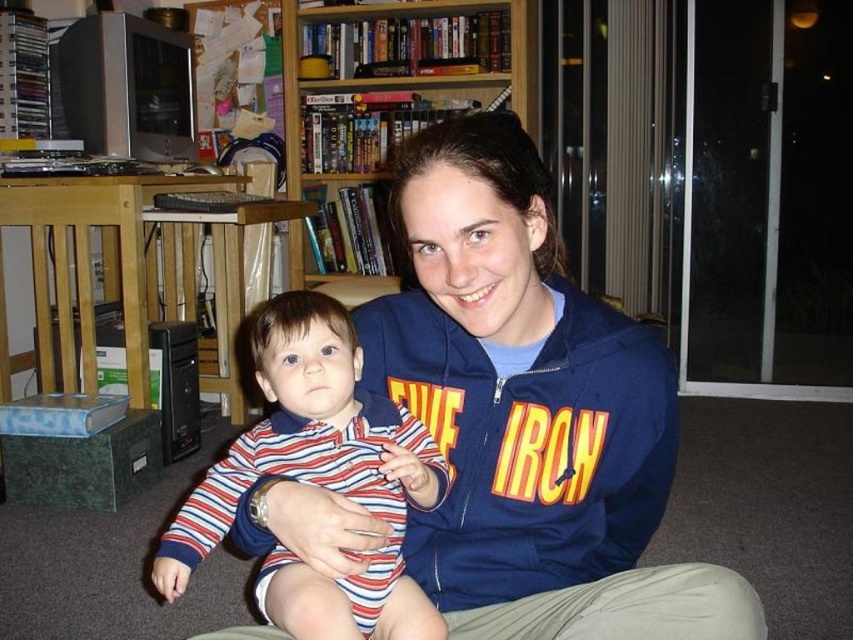
Question: Estimate the real-world distances between objects in this image. Which object is farther from the striped cotton onesie at center?

Choices:
 (A) navy blue hoodie at center
 (B) wooden bookshelf at upper center

Answer: (B)

Question: Can you confirm if navy blue hoodie at center is wider than striped cotton onesie at center?

Choices:
 (A) no
 (B) yes

Answer: (B)

Question: Estimate the real-world distances between objects in this image. Which object is closer to the navy blue hoodie at center?

Choices:
 (A) wooden bookshelf at upper center
 (B) striped cotton onesie at center

Answer: (B)

Question: Which point is farther to the camera?

Choices:
 (A) navy blue hoodie at center
 (B) striped cotton onesie at center

Answer: (B)

Question: Can you confirm if navy blue hoodie at center is positioned below striped cotton onesie at center?

Choices:
 (A) yes
 (B) no

Answer: (B)

Question: Where is navy blue hoodie at center located in relation to wooden bookshelf at upper center in the image?

Choices:
 (A) right
 (B) left

Answer: (A)